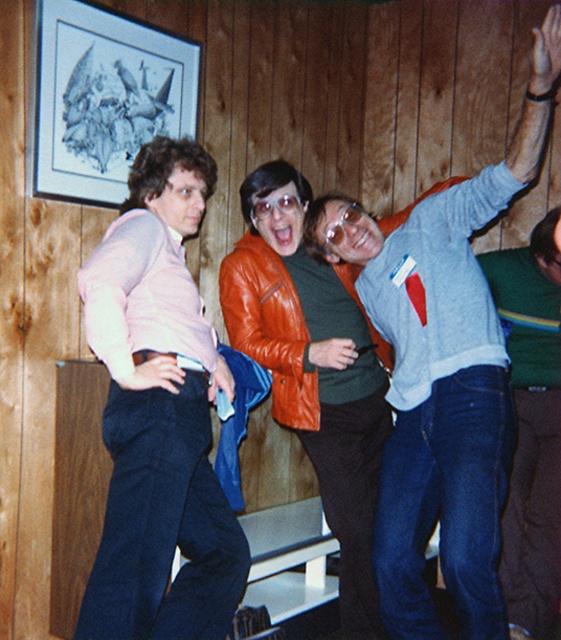
Consider the image. Can you confirm if light blue sweater at upper right is thinner than leather jacket at center?

Yes, light blue sweater at upper right is thinner than leather jacket at center.

Does light blue sweater at upper right appear under leather jacket at center?

No.

Describe the element at coordinates (443, 374) in the screenshot. I see `light blue sweater at upper right` at that location.

Where is `light blue sweater at upper right`? Image resolution: width=561 pixels, height=640 pixels. light blue sweater at upper right is located at coordinates (443, 374).

Is leather jacket at center smaller than blue jeans at lower right?

No, leather jacket at center is not smaller than blue jeans at lower right.

Is point (255, 291) more distant than point (518, 467)?

No, it is in front of (518, 467).

Locate an element on the screen. The width and height of the screenshot is (561, 640). leather jacket at center is located at coordinates (314, 369).

Is light blue sweater at upper right above matte pink sweater at left?

Yes, light blue sweater at upper right is above matte pink sweater at left.

Can you confirm if light blue sweater at upper right is positioned to the right of matte pink sweater at left?

Indeed, light blue sweater at upper right is positioned on the right side of matte pink sweater at left.

Between point (353, 225) and point (190, 582), which one is positioned in front?

Point (190, 582) is in front.

Where is `light blue sweater at upper right`? light blue sweater at upper right is located at coordinates (443, 374).